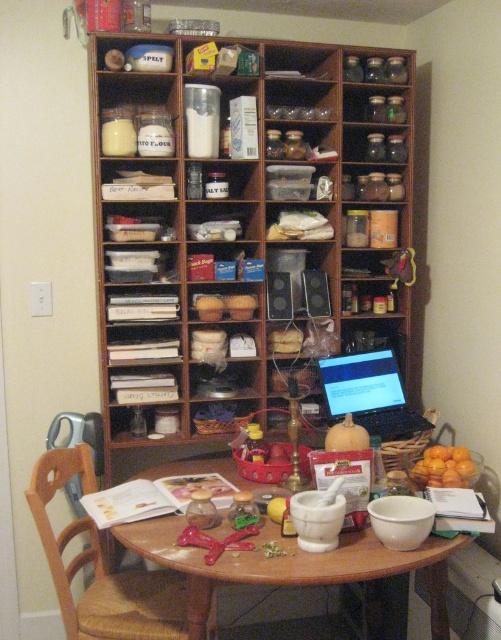
Can you confirm if black plastic laptop at center is bigger than orange matte at right?

Yes.

Can you confirm if black plastic laptop at center is thinner than orange matte at right?

No, black plastic laptop at center is not thinner than orange matte at right.

Which is in front, point (390, 436) or point (441, 474)?

Point (441, 474) is in front.

Locate an element on the screen. The image size is (501, 640). black plastic laptop at center is located at coordinates (370, 394).

Does point (104, 632) come in front of point (353, 369)?

Yes.

Does point (139, 628) come farther from viewer compared to point (326, 387)?

No.

Find the location of a particular element. Image resolution: width=501 pixels, height=640 pixels. wooden at left is located at coordinates (102, 566).

Is orange matte at right below yellow matte pumpkin at center?

Correct, orange matte at right is located below yellow matte pumpkin at center.

Who is positioned more to the right, orange matte at right or yellow matte pumpkin at center?

orange matte at right

Find the location of a particular element. orange matte at right is located at coordinates (443, 467).